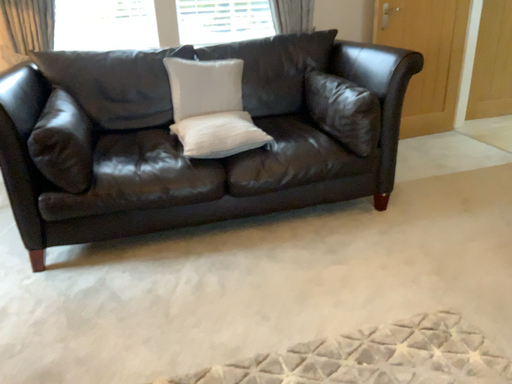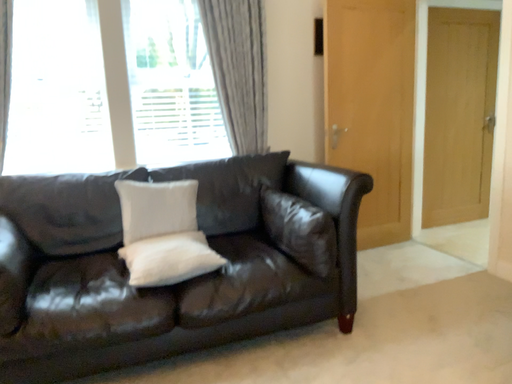
Question: How did the camera likely rotate when shooting the video?

Choices:
 (A) rotated downward
 (B) rotated upward

Answer: (B)